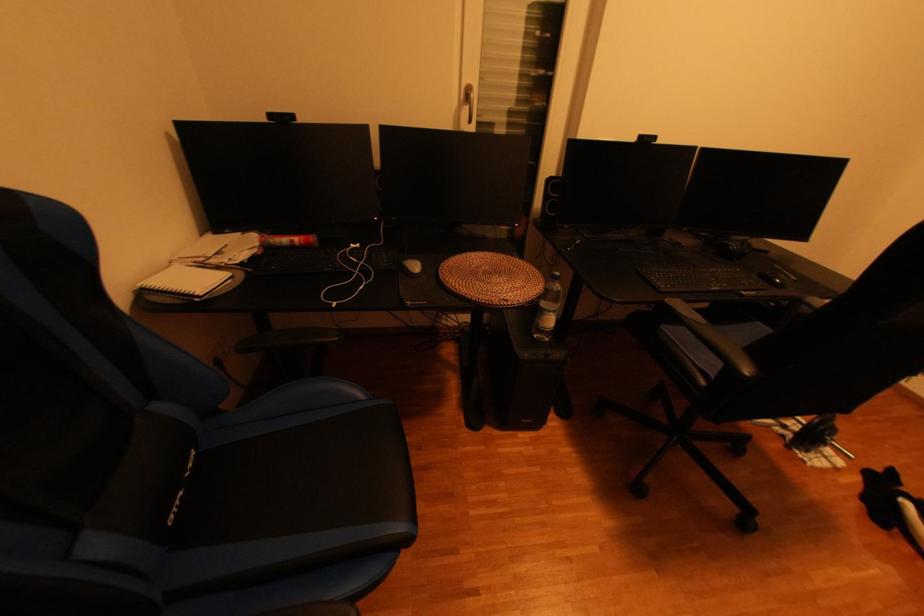
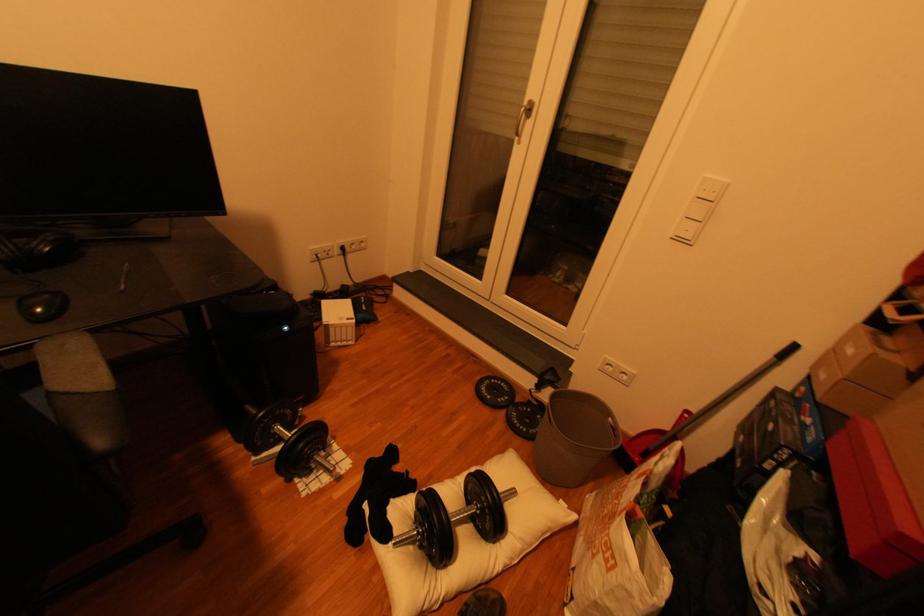
In the second image, find the point that corresponds to (x=787, y=283) in the first image.

(47, 310)